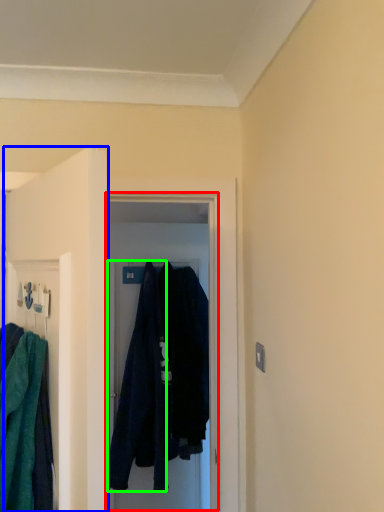
Question: Which is farther away from glass door (highlighted by a red box)? door (highlighted by a blue box) or robe (highlighted by a green box)?

Choices:
 (A) door
 (B) robe

Answer: (A)